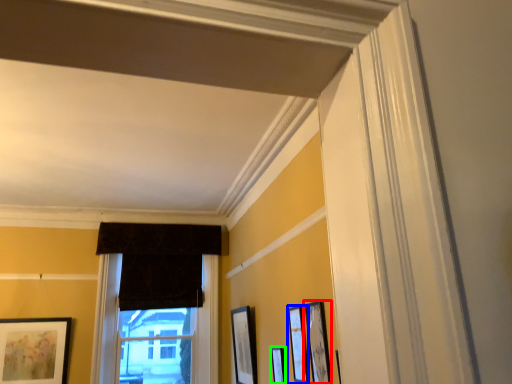
Question: Which object is the farthest from picture frame (highlighted by a red box)? Choose among these: picture frame (highlighted by a blue box) or picture frame (highlighted by a green box).

Choices:
 (A) picture frame
 (B) picture frame

Answer: (B)